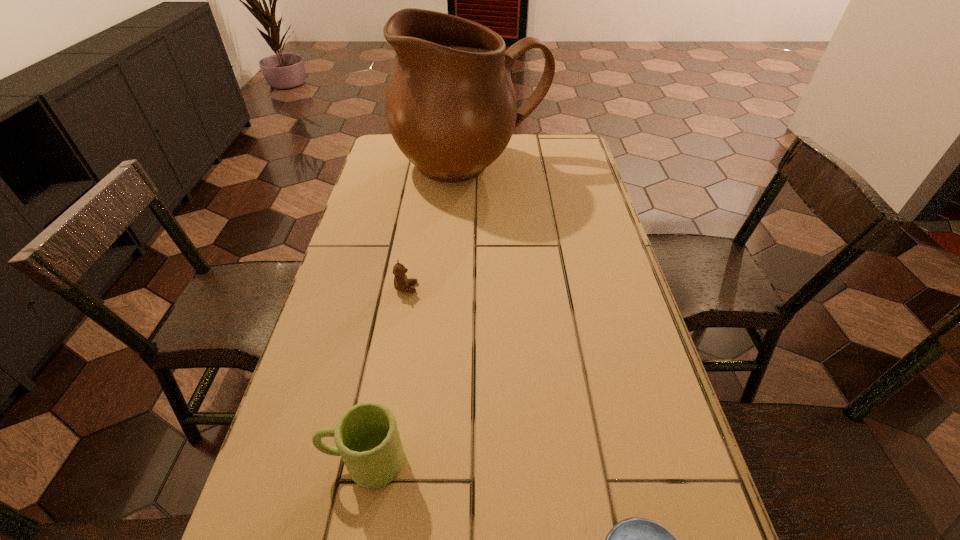
Identify the location of free space between the second shortest object and the cream pitcher. (439, 227).

Locate an element on the screen. Image resolution: width=960 pixels, height=540 pixels. free point between the tallest object and the mug is located at coordinates (418, 314).

Select which object appears as the closest to the tallest object. Please provide its 2D coordinates. Your answer should be formatted as a tuple, i.e. [(x, y)], where the tuple contains the x and y coordinates of a point satisfying the conditions above.

[(401, 282)]

You are a GUI agent. You are given a task and a screenshot of the screen. Output one action in this format:
    pyautogui.click(x=<x>, y=<y>)
    Task: Click on the object that is the third nearest to the tallest object
    This screenshot has width=960, height=540.
    Given the screenshot: What is the action you would take?
    pyautogui.click(x=634, y=539)

Where is `vacant region that satisfies the following two spatial constraints: 1. at the spout of the cream pitcher; 2. on the front-facing side of the third tallest object`? The width and height of the screenshot is (960, 540). vacant region that satisfies the following two spatial constraints: 1. at the spout of the cream pitcher; 2. on the front-facing side of the third tallest object is located at coordinates (468, 288).

At what (x,y) coordinates should I click in order to perform the action: click on free space that satisfies the following two spatial constraints: 1. at the spout of the cream pitcher; 2. on the side of the third farthest object with the handle. Please return your answer as a coordinate pair (x, y). Image resolution: width=960 pixels, height=540 pixels. Looking at the image, I should click on (464, 461).

Identify the location of free space in the image that satisfies the following two spatial constraints: 1. at the spout of the tallest object; 2. on the side of the second tallest object with the handle. (464, 461).

At what (x,y) coordinates should I click in order to perform the action: click on vacant region that satisfies the following two spatial constraints: 1. at the spout of the cream pitcher; 2. on the side of the second nearest object with the handle. Please return your answer as a coordinate pair (x, y). Looking at the image, I should click on (464, 461).

At what (x,y) coordinates should I click in order to perform the action: click on vacant area that satisfies the following two spatial constraints: 1. at the spout of the farthest object; 2. on the side of the mug with the handle. Please return your answer as a coordinate pair (x, y). This screenshot has height=540, width=960. Looking at the image, I should click on (464, 461).

What are the coordinates of `vacant area in the image that satisfies the following two spatial constraints: 1. at the spout of the farthest object; 2. on the front-facing side of the third nearest object` in the screenshot? It's located at (468, 288).